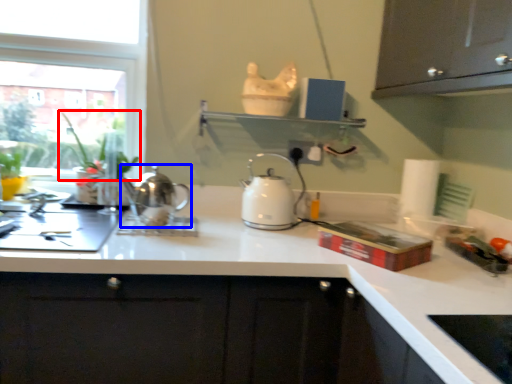
Question: Which of the following is the farthest to the observer, plant (highlighted by a red box) or kettle (highlighted by a blue box)?

Choices:
 (A) plant
 (B) kettle

Answer: (A)